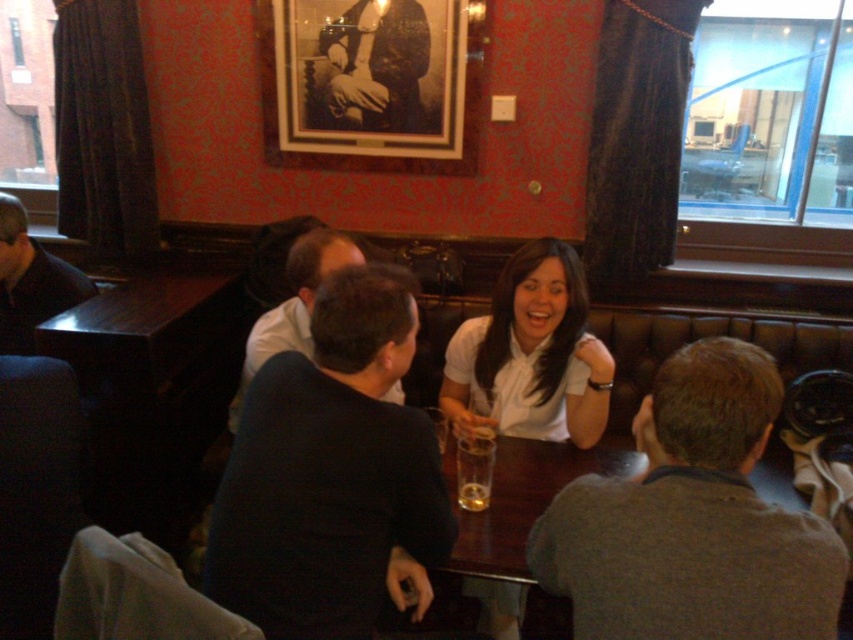
Question: Which object appears closest to the camera in this image?

Choices:
 (A) black matte photograph of man at upper center
 (B) dark blue shirt at center

Answer: (B)

Question: Which point is closer to the camera?

Choices:
 (A) dark blue sweater at center
 (B) dark blue shirt at center

Answer: (A)

Question: Is dark blue shirt at center to the right of translucent glass at table center from the viewer's perspective?

Choices:
 (A) no
 (B) yes

Answer: (A)

Question: Which point appears closest to the camera in this image?

Choices:
 (A) (323, 120)
 (B) (268, 8)
 (C) (352, 250)
 (D) (490, 444)

Answer: (D)

Question: Can you confirm if black matte picture frame at upper center is thinner than translucent glass at table center?

Choices:
 (A) no
 (B) yes

Answer: (A)

Question: Is black matte picture frame at upper center thinner than dark blue shirt at center?

Choices:
 (A) no
 (B) yes

Answer: (A)